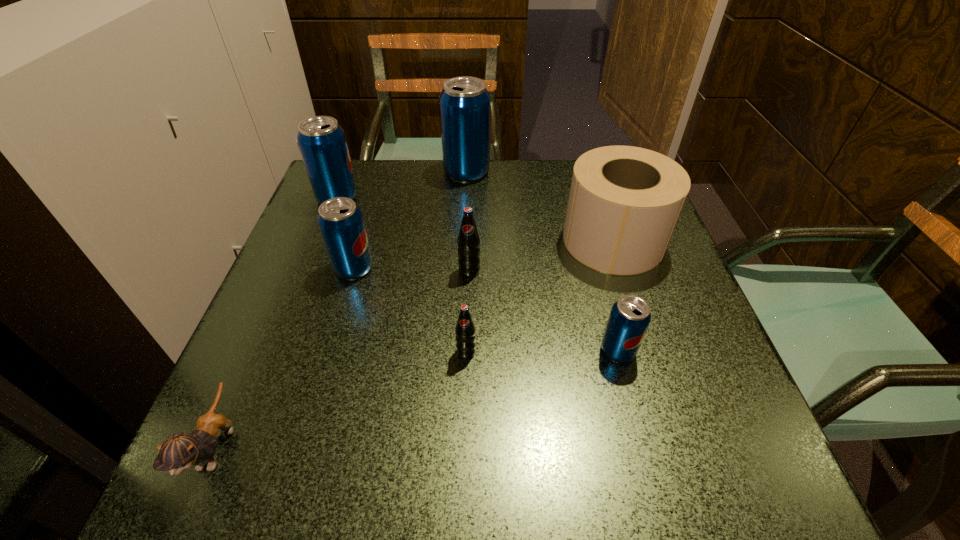
Locate an element on the screen. This screenshot has width=960, height=540. vacant area at the right edge is located at coordinates (666, 357).

The height and width of the screenshot is (540, 960). Identify the location of empty space that is in between the second nearest blue pop soda and the farther black pop. (412, 269).

Identify the location of free point between the kitten and the farther black pop. The width and height of the screenshot is (960, 540). (343, 358).

This screenshot has width=960, height=540. Identify the location of free spot between the nearest object and the farthest pop. (342, 309).

The height and width of the screenshot is (540, 960). I want to click on free spot between the toilet tissue and the nearest object, so click(415, 343).

Locate an element on the screen. free spot between the second farthest pop and the kitten is located at coordinates (276, 322).

Where is `free spot between the farthest object and the second biggest blue pop soda`? This screenshot has height=540, width=960. free spot between the farthest object and the second biggest blue pop soda is located at coordinates (402, 185).

The image size is (960, 540). I want to click on free space between the toilet tissue and the farther black pop, so (541, 255).

Locate an element on the screen. unoccupied area between the second blue pop soda from right to left and the toilet tissue is located at coordinates (540, 206).

Where is `unoccupied area between the third nearest blue pop soda and the smaller black pop`? The image size is (960, 540). unoccupied area between the third nearest blue pop soda and the smaller black pop is located at coordinates (401, 275).